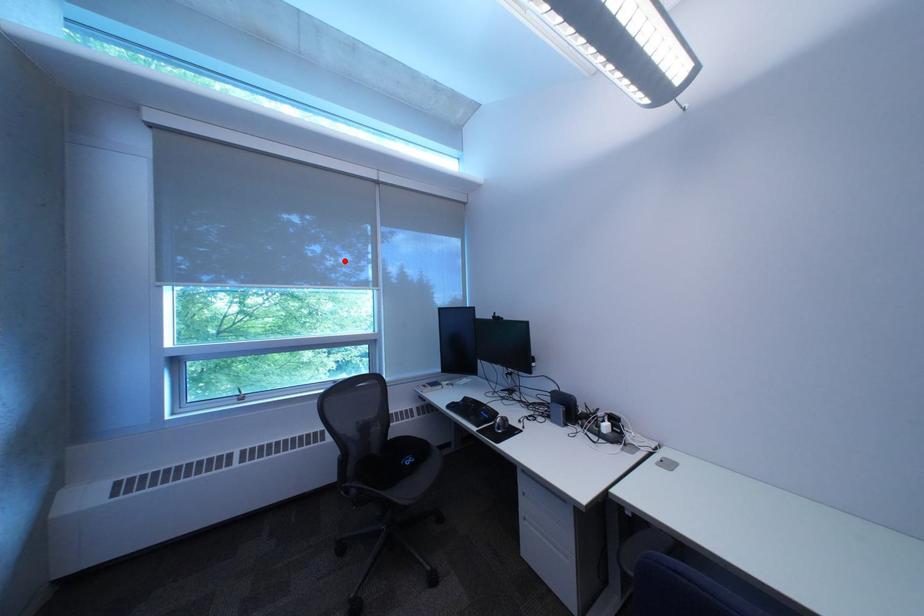
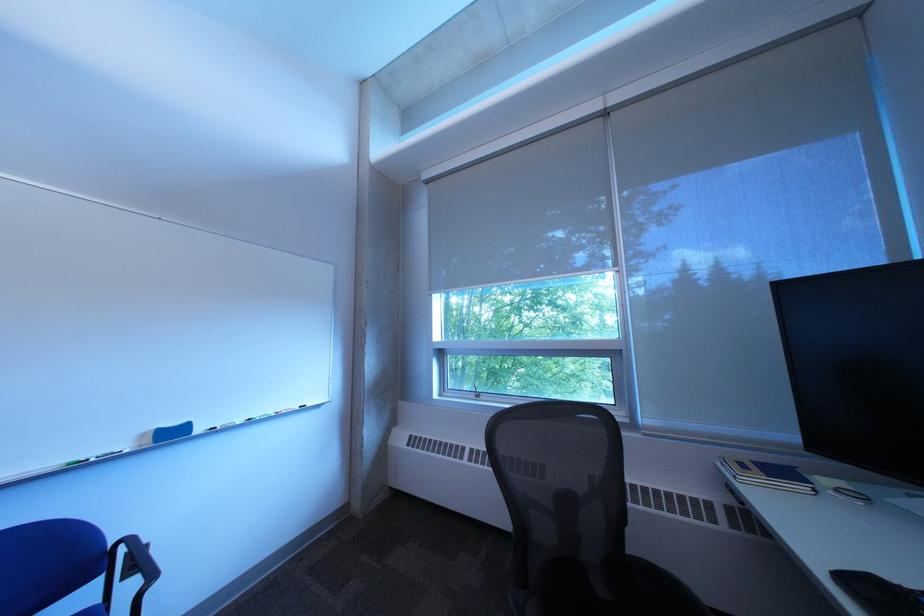
Question: I am providing you with two images of the same scene from different viewpoints. Image1 has a red point marked. In image2, the corresponding 3D location appears at what relative position? Reply with the corresponding letter.

Choices:
 (A) Closer
 (B) Farther

Answer: (A)